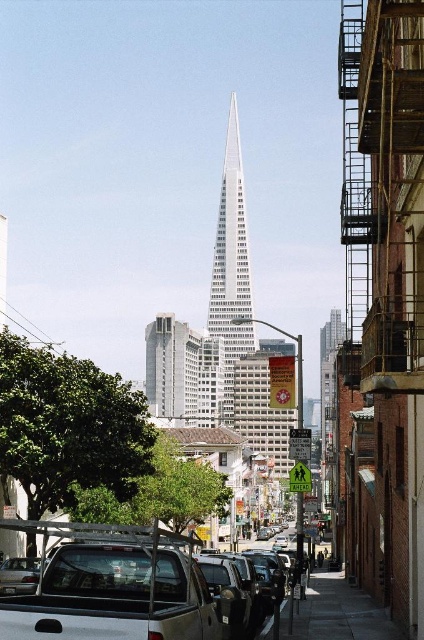
At what (x,y) coordinates should I click in order to perform the action: click on white matte truck at lower left. Please return your answer as a coordinate pair (x, y). Looking at the image, I should click on (111, 586).

Who is positioned more to the left, white matte truck at lower left or white glass skyscraper at center?

Positioned to the left is white matte truck at lower left.

Image resolution: width=424 pixels, height=640 pixels. I want to click on white matte truck at lower left, so click(x=111, y=586).

Can you confirm if white matte truck at lower left is taller than dark gray concrete sidewalk at lower center?

Indeed, white matte truck at lower left has a greater height compared to dark gray concrete sidewalk at lower center.

Who is taller, white matte truck at lower left or dark gray concrete sidewalk at lower center?

white matte truck at lower left is taller.

Which is in front, point (102, 612) or point (295, 628)?

Point (102, 612) is in front.

Locate an element on the screen. Image resolution: width=424 pixels, height=640 pixels. white matte truck at lower left is located at coordinates (111, 586).

Who is positioned more to the left, white glass skyscraper at center or dark gray concrete sidewalk at lower center?

white glass skyscraper at center

Is white glass skyscraper at center below dark gray concrete sidewalk at lower center?

Incorrect, white glass skyscraper at center is not positioned below dark gray concrete sidewalk at lower center.

Does point (236, 209) come behind point (318, 596)?

That is True.

The height and width of the screenshot is (640, 424). I want to click on white glass skyscraper at center, so click(231, 266).